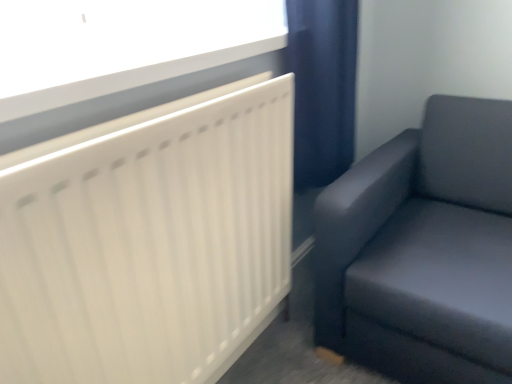
Question: Considering the relative sizes of white matte radiator at upper left and white plastic window sill at upper left in the image provided, is white matte radiator at upper left taller than white plastic window sill at upper left?

Choices:
 (A) no
 (B) yes

Answer: (B)

Question: Considering the relative sizes of white matte radiator at upper left and white plastic window sill at upper left in the image provided, is white matte radiator at upper left thinner than white plastic window sill at upper left?

Choices:
 (A) yes
 (B) no

Answer: (A)

Question: Does white matte radiator at upper left lie behind white plastic window sill at upper left?

Choices:
 (A) no
 (B) yes

Answer: (A)

Question: Can you see white matte radiator at upper left touching white plastic window sill at upper left?

Choices:
 (A) no
 (B) yes

Answer: (A)

Question: Is white plastic window sill at upper left at the back of white matte radiator at upper left?

Choices:
 (A) yes
 (B) no

Answer: (B)

Question: Considering the positions of point (478, 215) and point (275, 177), is point (478, 215) closer or farther from the camera than point (275, 177)?

Choices:
 (A) closer
 (B) farther

Answer: (B)

Question: Considering the positions of matte gray couch at right and white matte radiator at upper left in the image, is matte gray couch at right taller or shorter than white matte radiator at upper left?

Choices:
 (A) short
 (B) tall

Answer: (A)

Question: Considering the relative positions of matte gray couch at right and white matte radiator at upper left in the image provided, is matte gray couch at right to the left or to the right of white matte radiator at upper left?

Choices:
 (A) right
 (B) left

Answer: (A)

Question: From the image's perspective, relative to white matte radiator at upper left, is matte gray couch at right above or below?

Choices:
 (A) below
 (B) above

Answer: (B)

Question: Considering the positions of white plastic window sill at upper left and matte gray couch at right in the image, is white plastic window sill at upper left taller or shorter than matte gray couch at right?

Choices:
 (A) short
 (B) tall

Answer: (A)

Question: From the image's perspective, relative to matte gray couch at right, is white plastic window sill at upper left above or below?

Choices:
 (A) above
 (B) below

Answer: (A)

Question: Does point (11, 145) appear closer or farther from the camera than point (506, 148)?

Choices:
 (A) farther
 (B) closer

Answer: (B)

Question: Considering their positions, is white plastic window sill at upper left located in front of or behind matte gray couch at right?

Choices:
 (A) front
 (B) behind

Answer: (A)

Question: Is matte gray couch at right situated inside white plastic window sill at upper left or outside?

Choices:
 (A) outside
 (B) inside

Answer: (A)

Question: In terms of width, does matte gray couch at right look wider or thinner when compared to white plastic window sill at upper left?

Choices:
 (A) thin
 (B) wide

Answer: (B)